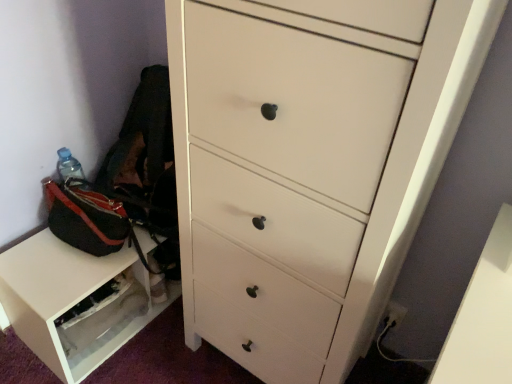
Question: Is white matte chest of drawers at center inside the boundaries of transparent plastic drawer at lower left, or outside?

Choices:
 (A) outside
 (B) inside

Answer: (A)

Question: Considering the relative positions of white matte chest of drawers at center and transparent plastic drawer at lower left in the image provided, is white matte chest of drawers at center to the left or to the right of transparent plastic drawer at lower left?

Choices:
 (A) right
 (B) left

Answer: (A)

Question: From the image's perspective, is white matte chest of drawers at center located above or below transparent plastic drawer at lower left?

Choices:
 (A) below
 (B) above

Answer: (B)

Question: From their relative heights in the image, would you say transparent plastic drawer at lower left is taller or shorter than white matte chest of drawers at center?

Choices:
 (A) tall
 (B) short

Answer: (B)

Question: Is transparent plastic drawer at lower left situated inside white matte chest of drawers at center or outside?

Choices:
 (A) outside
 (B) inside

Answer: (A)

Question: Considering the positions of point (131, 286) and point (302, 69), is point (131, 286) closer or farther from the camera than point (302, 69)?

Choices:
 (A) farther
 (B) closer

Answer: (A)

Question: From the image's perspective, relative to white matte chest of drawers at center, is transparent plastic drawer at lower left above or below?

Choices:
 (A) below
 (B) above

Answer: (A)